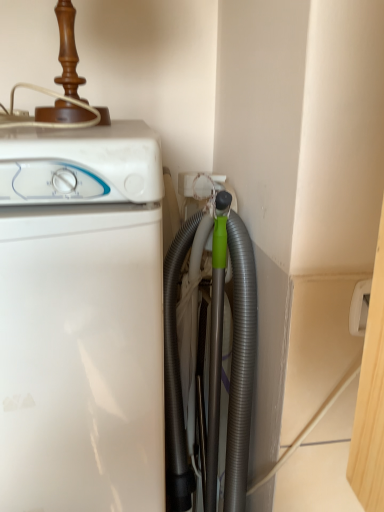
The height and width of the screenshot is (512, 384). Describe the element at coordinates (241, 360) in the screenshot. I see `gray rubber garden hose at lower right` at that location.

Image resolution: width=384 pixels, height=512 pixels. I want to click on gray rubber garden hose at lower right, so click(241, 360).

The image size is (384, 512). Find the location of `gray rubber garden hose at lower right`. gray rubber garden hose at lower right is located at coordinates (241, 360).